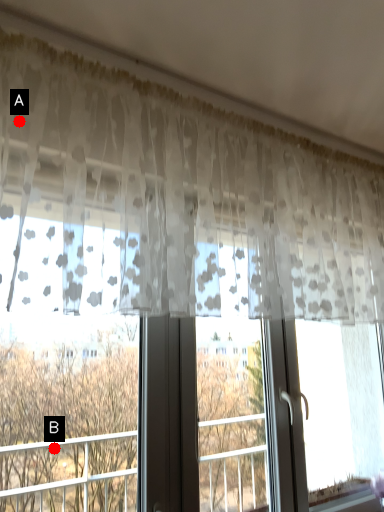
Question: Two points are circled on the image, labeled by A and B beside each circle. Among these points, which one is nearest to the camera?

Choices:
 (A) A is closer
 (B) B is closer

Answer: (A)